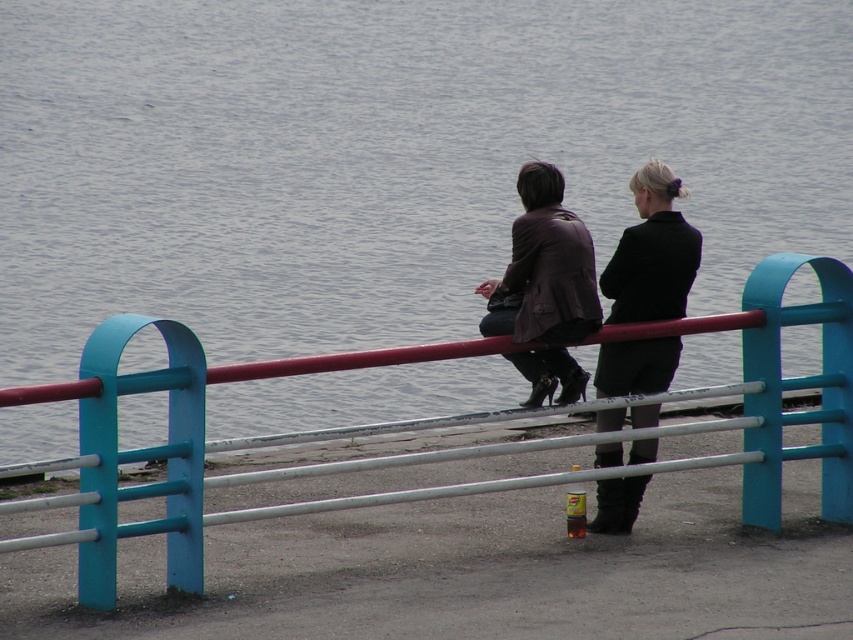
You are a photographer trying to capture a photo of the brown leather jacket at upper center and the teal plastic fence at lower center. To ensure both are in frame, should you adjust your camera to focus more on the left side or the right side?

The teal plastic fence at lower center is to the left of the brown leather jacket at upper center, so you should focus more on the left side to include both objects in the frame.

You are standing at the center of the image and want to place a small marker exactly at the teal plastic fence at lower center. According to the coordinates provided, where should you place the marker?

The teal plastic fence at lower center should be placed at the coordinates point (439, 451).